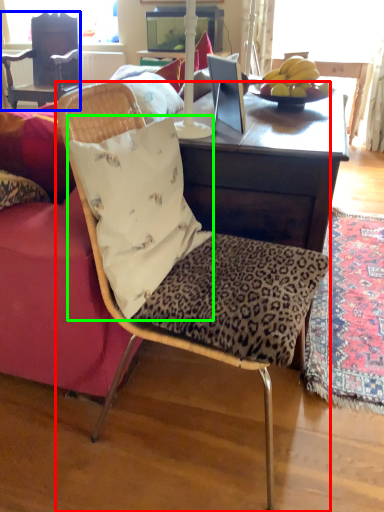
Question: Based on their relative distances, which object is nearer to chair (highlighted by a red box)? Choose from chair (highlighted by a blue box) and pillow (highlighted by a green box).

Choices:
 (A) chair
 (B) pillow

Answer: (B)